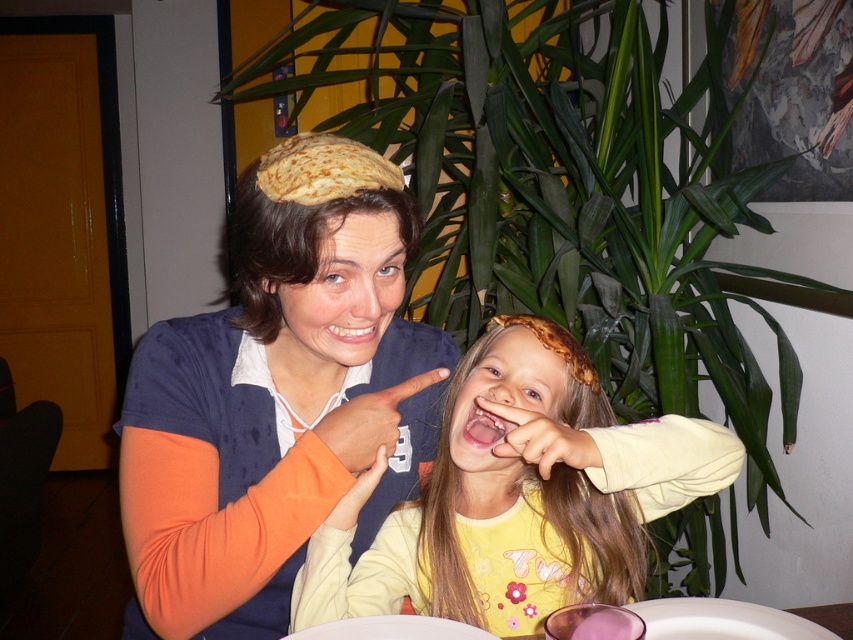
Who is taller, matte brown beret at upper center or yellow matte shirt at center?

matte brown beret at upper center is taller.

Can you confirm if matte brown beret at upper center is bigger than yellow matte shirt at center?

Actually, matte brown beret at upper center might be smaller than yellow matte shirt at center.

At what (x,y) coordinates should I click in order to perform the action: click on matte brown beret at upper center. Please return your answer as a coordinate pair (x, y). The height and width of the screenshot is (640, 853). Looking at the image, I should click on (276, 394).